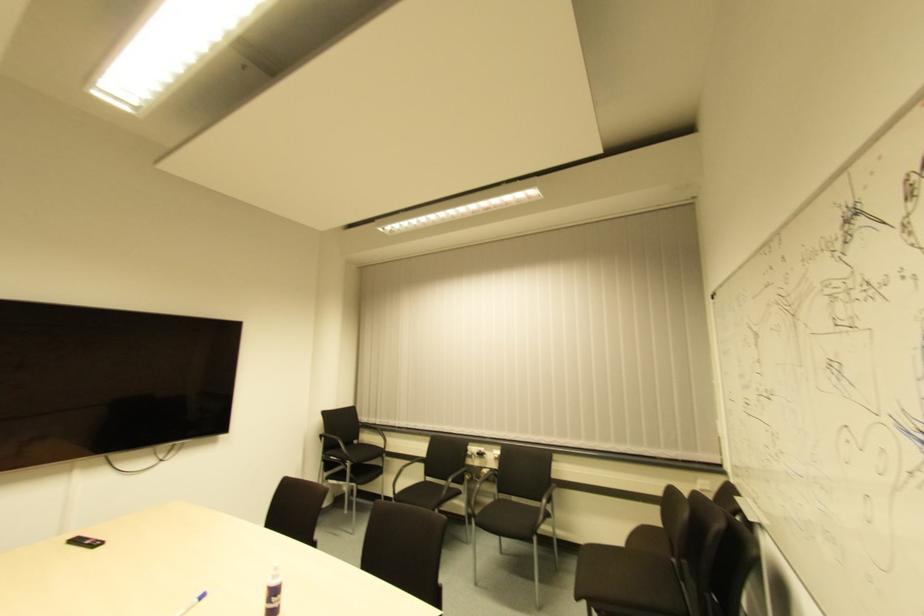
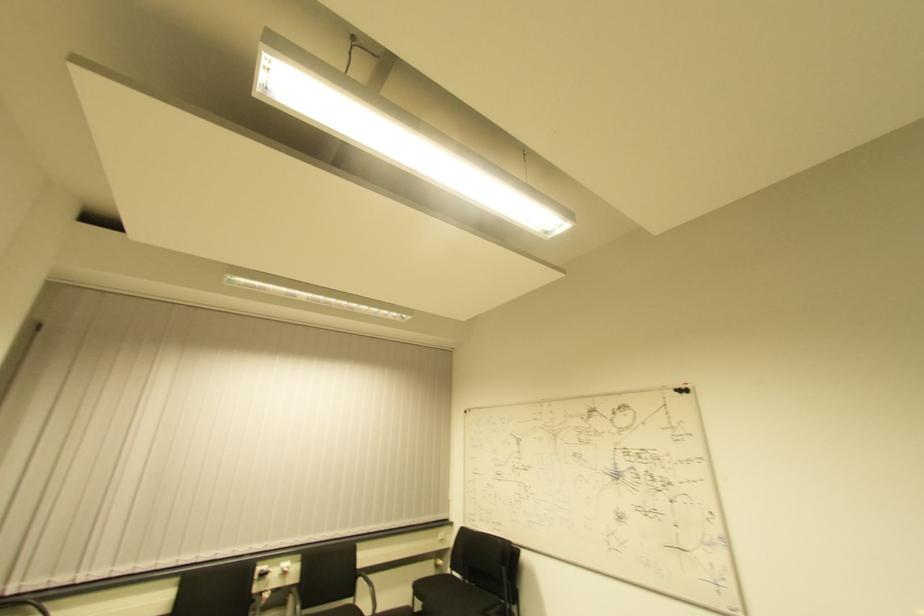
Find the pixel in the second image that matches (x=723, y=477) in the first image.

(450, 527)